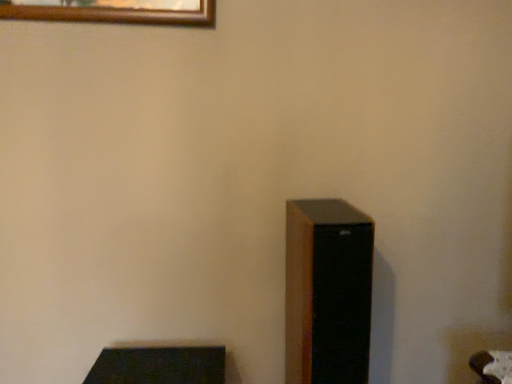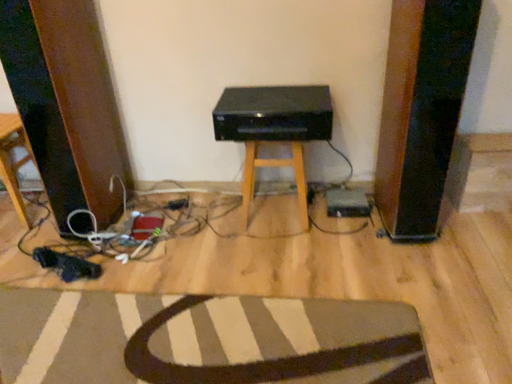
Question: Which way did the camera rotate in the video?

Choices:
 (A) rotated upward
 (B) rotated downward

Answer: (B)